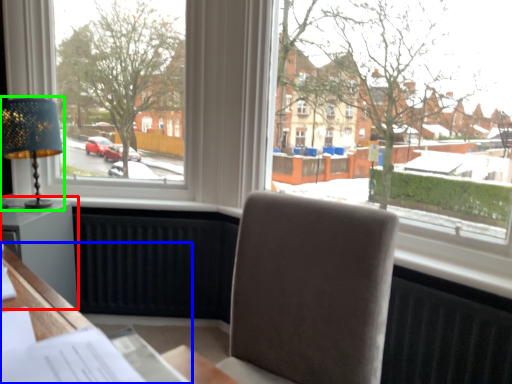
Question: Based on their relative distances, which object is nearer to table (highlighted by a red box)? Choose from desk (highlighted by a blue box) and table lamp (highlighted by a green box).

Choices:
 (A) desk
 (B) table lamp

Answer: (B)